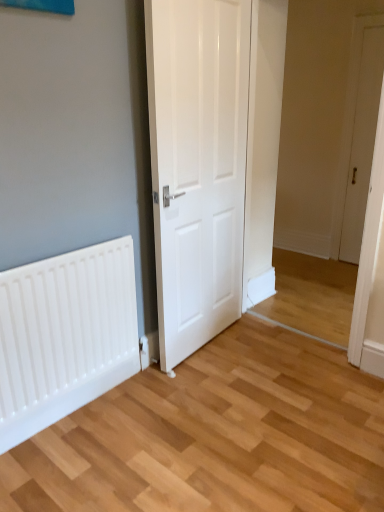
Locate an element on the screen. vacant space in front of white glossy door at center, the second door positioned from the right is located at coordinates (218, 389).